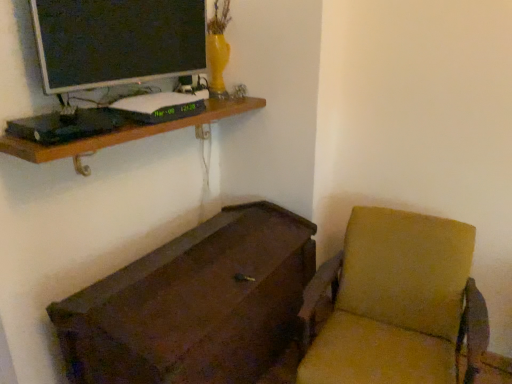
Find the location of a particular element. textured beige swivel chair at lower right is located at coordinates (396, 303).

Describe the element at coordinates (126, 133) in the screenshot. The image size is (512, 384). I see `brown wooden shelf at upper left` at that location.

I want to click on matte black monitor at upper left, so click(117, 41).

The height and width of the screenshot is (384, 512). I want to click on textured beige swivel chair at lower right, so click(396, 303).

Is textured beige swivel chair at lower right inside brown wooden chest at lower left?

No, textured beige swivel chair at lower right is located outside of brown wooden chest at lower left.

From a real-world perspective, does brown wooden chest at lower left stand above textured beige swivel chair at lower right?

No, from a real-world perspective, brown wooden chest at lower left is not above textured beige swivel chair at lower right.

Looking at this image, which of these two, brown wooden chest at lower left or textured beige swivel chair at lower right, stands taller?

textured beige swivel chair at lower right is taller.

Considering the sizes of brown wooden chest at lower left and textured beige swivel chair at lower right in the image, is brown wooden chest at lower left bigger or smaller than textured beige swivel chair at lower right?

In the image, brown wooden chest at lower left appears to be larger than textured beige swivel chair at lower right.

Which object is closer to the camera taking this photo, brown wooden shelf at upper left or textured beige swivel chair at lower right?

textured beige swivel chair at lower right is closer to the camera.

Considering the sizes of objects brown wooden shelf at upper left and textured beige swivel chair at lower right in the image provided, who is wider, brown wooden shelf at upper left or textured beige swivel chair at lower right?

Wider between the two is textured beige swivel chair at lower right.

Between point (67, 148) and point (352, 343), which one is positioned in front?

The point (67, 148) is in front.

Is brown wooden shelf at upper left turned away from textured beige swivel chair at lower right?

No, brown wooden shelf at upper left is not facing the opposite direction of textured beige swivel chair at lower right.

Is textured beige swivel chair at lower right facing away from matte black monitor at upper left?

textured beige swivel chair at lower right does not have its back to matte black monitor at upper left.

Who is smaller, textured beige swivel chair at lower right or matte black monitor at upper left?

With smaller size is matte black monitor at upper left.

Which is closer, (438, 251) or (175, 75)?

Point (438, 251) is closer to the camera than point (175, 75).

Is matte black monitor at upper left located within textured beige swivel chair at lower right?

No, matte black monitor at upper left is not surrounded by textured beige swivel chair at lower right.

Between brown wooden chest at lower left and brown wooden shelf at upper left, which one has smaller size?

brown wooden shelf at upper left is smaller.

Which object is positioned more to the right, brown wooden chest at lower left or brown wooden shelf at upper left?

brown wooden chest at lower left is more to the right.

Which object is closer to the camera taking this photo, brown wooden chest at lower left or brown wooden shelf at upper left?

brown wooden chest at lower left is more forward.

From a real-world perspective, is brown wooden chest at lower left on top of brown wooden shelf at upper left?

No, from a real-world perspective, brown wooden chest at lower left is not over brown wooden shelf at upper left

Is there a large distance between brown wooden shelf at upper left and matte black monitor at upper left?

No, brown wooden shelf at upper left is not far away from matte black monitor at upper left.

From the picture: Considering the sizes of brown wooden shelf at upper left and matte black monitor at upper left in the image, is brown wooden shelf at upper left bigger or smaller than matte black monitor at upper left?

Clearly, brown wooden shelf at upper left is larger in size than matte black monitor at upper left.

Which point is more distant from viewer, (9, 148) or (111, 47)?

Point (111, 47)

Locate an element on the screen. The height and width of the screenshot is (384, 512). shelf in front of the matte black monitor at upper left is located at coordinates (126, 133).

What's the angular difference between brown wooden chest at lower left and matte black monitor at upper left's facing directions?

87.7 degrees.

Identify the location of computer monitor on the left of brown wooden chest at lower left. This screenshot has height=384, width=512. (117, 41).

From the image's perspective, would you say brown wooden chest at lower left is shown under matte black monitor at upper left?

Yes, from the image's perspective, brown wooden chest at lower left is below matte black monitor at upper left.

From a real-world perspective, relative to matte black monitor at upper left, is brown wooden chest at lower left vertically above or below?

Clearly, from a real-world perspective, brown wooden chest at lower left is below matte black monitor at upper left.

How distant is matte black monitor at upper left from textured beige swivel chair at lower right?

matte black monitor at upper left and textured beige swivel chair at lower right are 1.18 meters apart.

Are matte black monitor at upper left and textured beige swivel chair at lower right far apart?

matte black monitor at upper left is positioned a significant distance from textured beige swivel chair at lower right.

From a real-world perspective, does matte black monitor at upper left sit lower than textured beige swivel chair at lower right?

No, from a real-world perspective, matte black monitor at upper left is not under textured beige swivel chair at lower right.

Consider the image. Would you say matte black monitor at upper left contains textured beige swivel chair at lower right?

That's incorrect, textured beige swivel chair at lower right is not inside matte black monitor at upper left.

You are a GUI agent. You are given a task and a screenshot of the screen. Output one action in this format:
    pyautogui.click(x=<x>, y=<y>)
    Task: Click on the furniture that appears below the textured beige swivel chair at lower right (from a real-world perspective)
    The width and height of the screenshot is (512, 384).
    Given the screenshot: What is the action you would take?
    pyautogui.click(x=194, y=304)

Locate an element on the screen. The height and width of the screenshot is (384, 512). shelf above the textured beige swivel chair at lower right (from the image's perspective) is located at coordinates (126, 133).

Estimate the real-world distances between objects in this image. Which object is closer to brown wooden chest at lower left, textured beige swivel chair at lower right or brown wooden shelf at upper left?

Among the two, textured beige swivel chair at lower right is located nearer to brown wooden chest at lower left.

Which object lies nearer to the anchor point brown wooden chest at lower left, matte black monitor at upper left or brown wooden shelf at upper left?

brown wooden shelf at upper left is positioned closer to the anchor brown wooden chest at lower left.

From the picture: Considering their positions, is matte black monitor at upper left positioned further to brown wooden chest at lower left than textured beige swivel chair at lower right?

The object further to brown wooden chest at lower left is matte black monitor at upper left.

Estimate the real-world distances between objects in this image. Which object is closer to textured beige swivel chair at lower right, matte black monitor at upper left or brown wooden shelf at upper left?

brown wooden shelf at upper left is closer to textured beige swivel chair at lower right.

Looking at the image, which one is located closer to brown wooden chest at lower left, brown wooden shelf at upper left or textured beige swivel chair at lower right?

textured beige swivel chair at lower right is positioned closer to the anchor brown wooden chest at lower left.

From the picture: From the image, which object appears to be farther from brown wooden chest at lower left, textured beige swivel chair at lower right or matte black monitor at upper left?

matte black monitor at upper left.

Consider the image. Estimate the real-world distances between objects in this image. Which object is closer to textured beige swivel chair at lower right, brown wooden chest at lower left or matte black monitor at upper left?

brown wooden chest at lower left is positioned closer to the anchor textured beige swivel chair at lower right.

Looking at the image, which one is located further to matte black monitor at upper left, textured beige swivel chair at lower right or brown wooden chest at lower left?

Among the two, textured beige swivel chair at lower right is located further to matte black monitor at upper left.

Where is `shelf between matte black monitor at upper left and textured beige swivel chair at lower right vertically`? This screenshot has height=384, width=512. shelf between matte black monitor at upper left and textured beige swivel chair at lower right vertically is located at coordinates (126, 133).

You are a GUI agent. You are given a task and a screenshot of the screen. Output one action in this format:
    pyautogui.click(x=<x>, y=<y>)
    Task: Click on the furniture between matte black monitor at upper left and textured beige swivel chair at lower right in the vertical direction
    Image resolution: width=512 pixels, height=384 pixels.
    Given the screenshot: What is the action you would take?
    pyautogui.click(x=194, y=304)

What are the coordinates of `shelf between matte black monitor at upper left and brown wooden chest at lower left in the vertical direction` in the screenshot? It's located at pyautogui.click(x=126, y=133).

At what (x,y) coordinates should I click in order to perform the action: click on furniture between brown wooden shelf at upper left and textured beige swivel chair at lower right from left to right. Please return your answer as a coordinate pair (x, y). Looking at the image, I should click on (x=194, y=304).